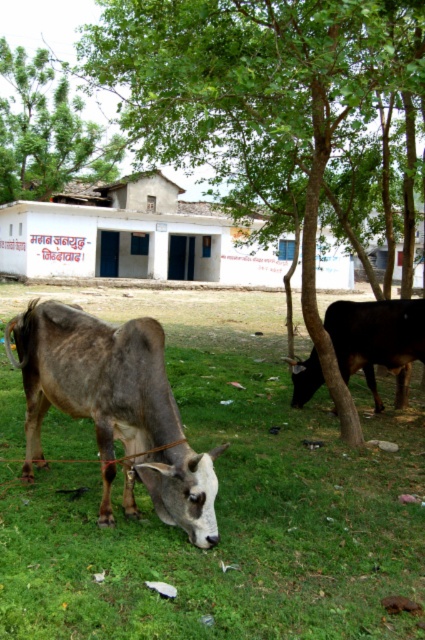
Question: Which point is farther from the camera taking this photo?

Choices:
 (A) (309, 333)
 (B) (172, 403)
 (C) (81, 150)

Answer: (C)

Question: Among these objects, which one is farthest from the camera?

Choices:
 (A) shiny brown bull at right
 (B) green grass at lower center

Answer: (A)

Question: Estimate the real-world distances between objects in this image. Which object is farther from the shiny brown bull at right?

Choices:
 (A) green leafy tree at center
 (B) green leafy tree at upper left
 (C) gray matte cow at lower left
 (D) green grass at lower center

Answer: (B)

Question: Does gray matte cow at lower left appear on the left side of green leafy tree at upper left?

Choices:
 (A) yes
 (B) no

Answer: (B)

Question: Can you confirm if green grass at lower center is positioned above shiny brown bull at right?

Choices:
 (A) yes
 (B) no

Answer: (B)

Question: Does green leafy tree at center lie behind gray matte cow at lower left?

Choices:
 (A) yes
 (B) no

Answer: (A)